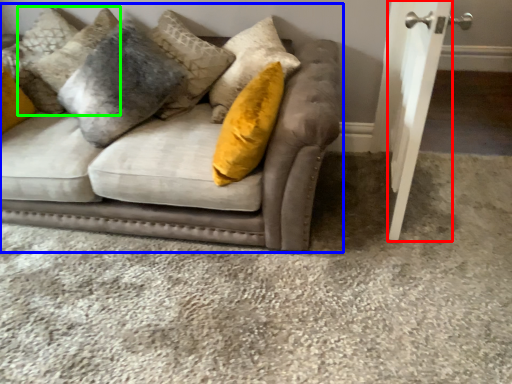
Question: Estimate the real-world distances between objects in this image. Which object is farther from door (highlighted by a red box), studio couch (highlighted by a blue box) or pillow (highlighted by a green box)?

Choices:
 (A) studio couch
 (B) pillow

Answer: (B)